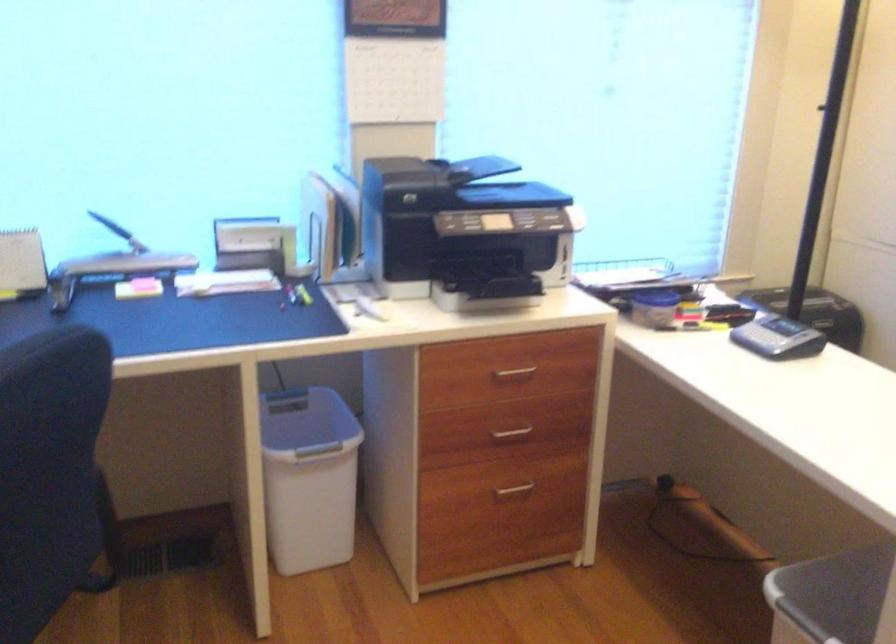
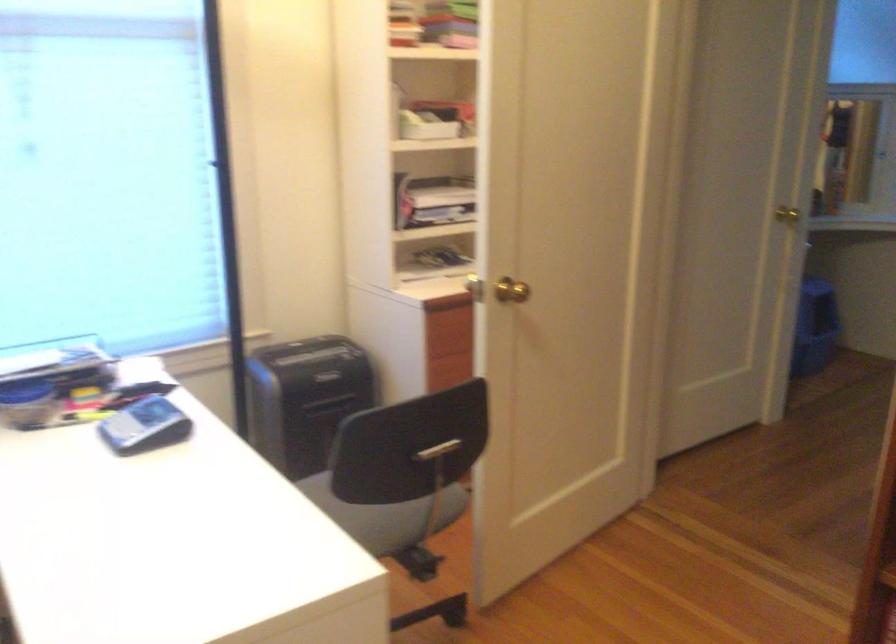
Question: How did the camera likely rotate?

Choices:
 (A) Left
 (B) Right
 (C) Up
 (D) Down

Answer: (B)